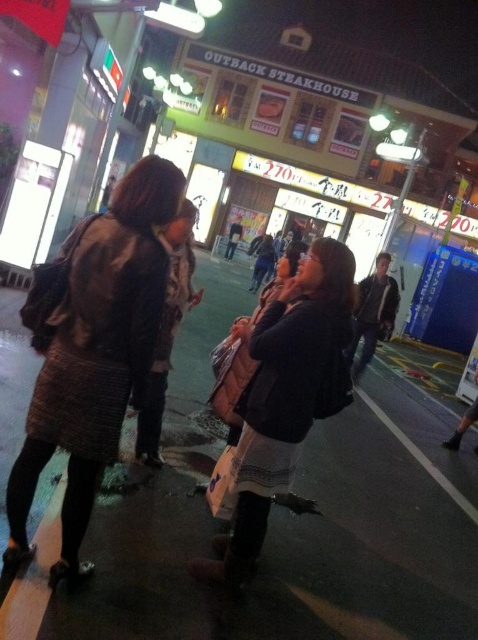
Is dark asphalt pavement at center wider than knitted wool coat at center?

No.

Is dark asphalt pavement at center to the right of knitted wool coat at center from the viewer's perspective?

In fact, dark asphalt pavement at center is to the left of knitted wool coat at center.

Is point (347, 595) positioned behind point (35, 275)?

Yes, it is behind point (35, 275).

Where is `dark asphalt pavement at center`? This screenshot has height=640, width=478. dark asphalt pavement at center is located at coordinates (290, 522).

Which is in front, point (42, 400) or point (338, 284)?

Positioned in front is point (42, 400).

Is knitted wool coat at center to the right of dark brown leather jacket at center from the viewer's perspective?

No, knitted wool coat at center is not to the right of dark brown leather jacket at center.

Is point (119, 412) less distant than point (284, 449)?

Yes.

I want to click on knitted wool coat at center, so click(91, 352).

Is dark asphalt pavement at center thinner than dark brown leather jacket at center?

Correct, dark asphalt pavement at center's width is less than dark brown leather jacket at center's.

Which is more to the right, dark asphalt pavement at center or dark brown leather jacket at center?

dark brown leather jacket at center

What do you see at coordinates (290, 522) in the screenshot?
I see `dark asphalt pavement at center` at bounding box center [290, 522].

This screenshot has width=478, height=640. Identify the location of dark asphalt pavement at center. (290, 522).